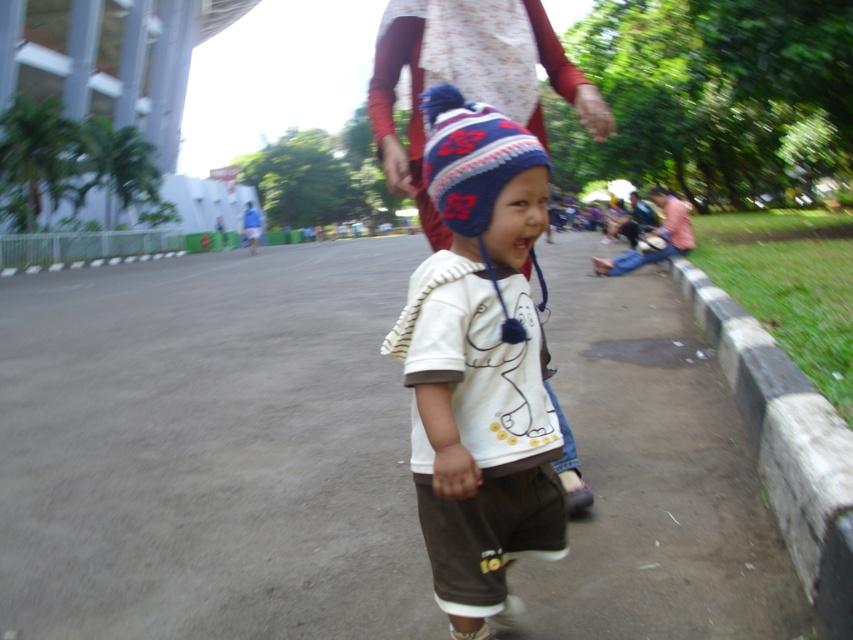
Question: Which object appears closest to the camera in this image?

Choices:
 (A) white soft t-shirt at center
 (B) black concrete curb at lower right
 (C) knitted woolen hat at center
 (D) gray asphalt pavement at center

Answer: (A)

Question: Which point is farther to the camera?

Choices:
 (A) black concrete curb at lower right
 (B) knitted woolen hat at center

Answer: (A)

Question: Is white soft t-shirt at center closer to the viewer compared to black concrete curb at lower right?

Choices:
 (A) no
 (B) yes

Answer: (B)

Question: Can you confirm if gray asphalt pavement at center is positioned above black concrete curb at lower right?

Choices:
 (A) yes
 (B) no

Answer: (A)

Question: Which of the following is the closest to the observer?

Choices:
 (A) black concrete curb at lower right
 (B) gray asphalt pavement at center
 (C) knitted woolen hat at center

Answer: (C)

Question: Is white soft t-shirt at center to the right of black concrete curb at lower right from the viewer's perspective?

Choices:
 (A) no
 (B) yes

Answer: (A)